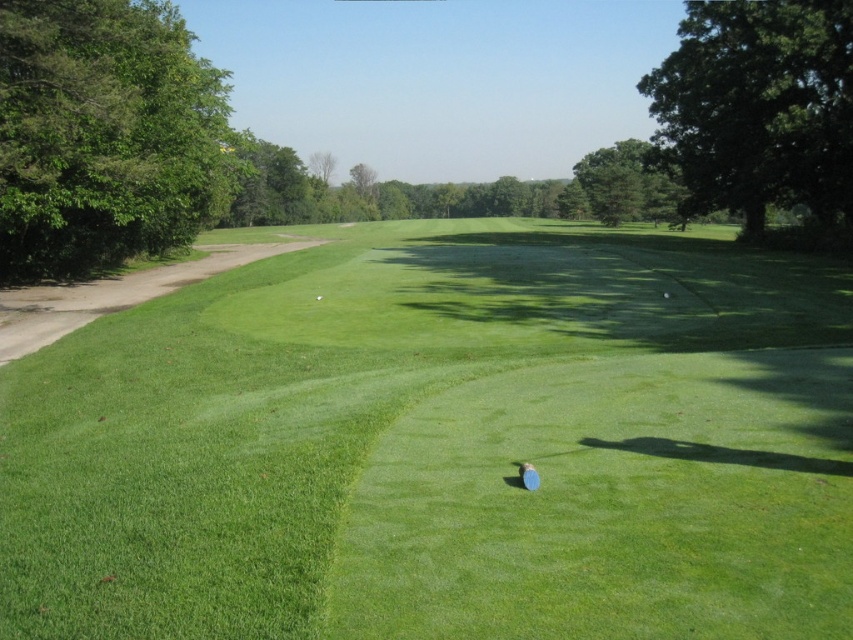
Is green grassy golf course at center taller than green rubber golf ball at center?

Correct, green grassy golf course at center is much taller as green rubber golf ball at center.

Between point (175, 323) and point (318, 296), which one is positioned behind?

Point (318, 296)

Which is behind, point (299, 509) or point (318, 298)?

Point (318, 298)

What are the coordinates of `green grassy golf course at center` in the screenshot? It's located at pyautogui.click(x=444, y=445).